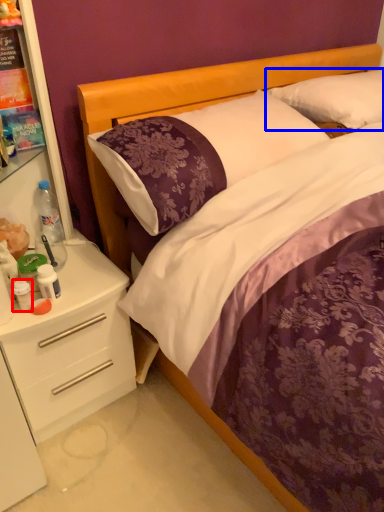
Question: Which of the following is the closest to the observer, bottle (highlighted by a red box) or pillow (highlighted by a blue box)?

Choices:
 (A) bottle
 (B) pillow

Answer: (A)